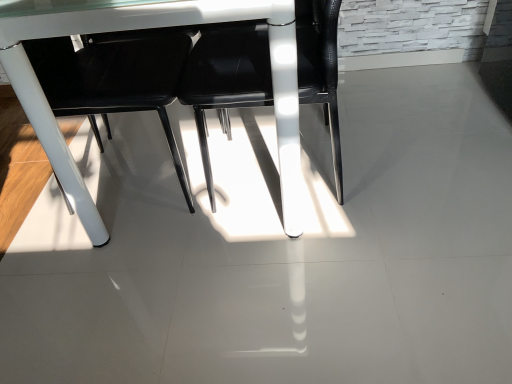
Find the location of `vacant space to the right of black leather chair at center, which appears as the 2th chair when viewed from the left`. vacant space to the right of black leather chair at center, which appears as the 2th chair when viewed from the left is located at coordinates (419, 171).